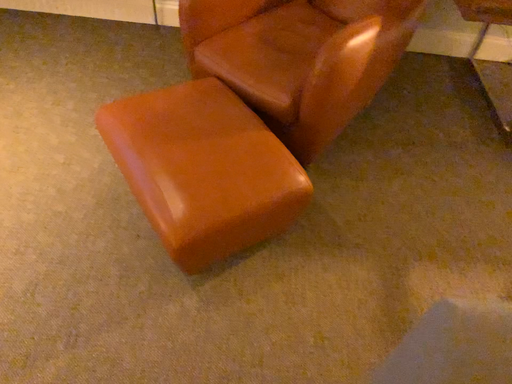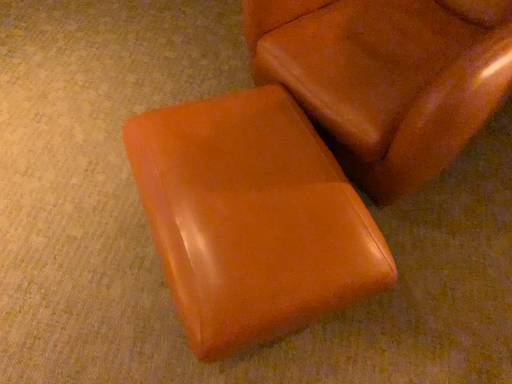
Question: Which way did the camera rotate in the video?

Choices:
 (A) rotated upward
 (B) rotated downward

Answer: (B)